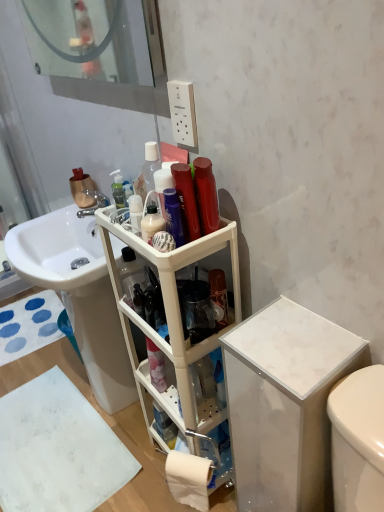
How much space does white plastic shelf at center, which ranks as the 1th cabinetry in left-to-right order, occupy horizontally?

It is 10.60 inches.

In order to face white glossy sink at center, should I rotate leftwards or rightwards?

Turn left by 13.289 degrees to look at white glossy sink at center.

Image resolution: width=384 pixels, height=512 pixels. I want to click on white matte bath mat at lower left, positioned as the 2th bath mat in back-to-front order, so (x=58, y=449).

Identify the location of shiny red bottle at upper center, the 2th cleaning product from the left. This screenshot has height=512, width=384. click(x=206, y=195).

Is white plastic shelf at center, the second cabinetry in the right-to-left sequence, next to metallic silver faucet at sink left?

white plastic shelf at center, the second cabinetry in the right-to-left sequence, is not next to metallic silver faucet at sink left, and they're not touching.

Is white plastic shelf at center, which ranks as the 1th cabinetry in left-to-right order, bigger or smaller than metallic silver faucet at sink left?

white plastic shelf at center, which ranks as the 1th cabinetry in left-to-right order, is bigger than metallic silver faucet at sink left.

From the image's perspective, is white plastic shelf at center, the second cabinetry in the right-to-left sequence, below metallic silver faucet at sink left?

Yes, from the image's perspective, white plastic shelf at center, the second cabinetry in the right-to-left sequence, is below metallic silver faucet at sink left.

Considering their positions, is white plastic shelf at center, which ranks as the 1th cabinetry in left-to-right order, located in front of or behind metallic silver faucet at sink left?

In the image, white plastic shelf at center, which ranks as the 1th cabinetry in left-to-right order, appears in front of metallic silver faucet at sink left.

Is point (201, 186) closer or farther from the camera than point (303, 335)?

Point (201, 186) appears to be farther away from the viewer than point (303, 335).

Does shiny red bottle at upper center, which is counted as the first cleaning product, starting from the right, lie in front of white marble cabinet at right, arranged as the second cabinetry when viewed from the left?

No, it is not.

Is shiny red bottle at upper center, the 2th cleaning product from the left, far away from white marble cabinet at right, arranged as the second cabinetry when viewed from the left?

No, shiny red bottle at upper center, the 2th cleaning product from the left, is not far away from white marble cabinet at right, arranged as the second cabinetry when viewed from the left.

Choose the correct answer: Is shiny red bottle at upper center, which is counted as the first cleaning product, starting from the right, inside shiny red hair spray at upper center, which is counted as the 1th toiletry, starting from the top, or outside it?

shiny red bottle at upper center, which is counted as the first cleaning product, starting from the right, exists outside the volume of shiny red hair spray at upper center, which is counted as the 1th toiletry, starting from the top.

From a real-world perspective, is shiny red bottle at upper center, which is counted as the first cleaning product, starting from the right, positioned over shiny red hair spray at upper center, which ranks as the 4th toiletry in back-to-front order, based on gravity?

No, from a real-world perspective, shiny red bottle at upper center, which is counted as the first cleaning product, starting from the right, is not on top of shiny red hair spray at upper center, which ranks as the 4th toiletry in back-to-front order.

In terms of height, does shiny red bottle at upper center, the 2th cleaning product from the left, look taller or shorter compared to shiny red hair spray at upper center, the fourth toiletry when ordered from bottom to top?

In the image, shiny red bottle at upper center, the 2th cleaning product from the left, appears to be shorter than shiny red hair spray at upper center, the fourth toiletry when ordered from bottom to top.

Is point (185, 189) positioned before point (133, 357)?

Yes, point (185, 189) is in front of point (133, 357).

Is shiny red hair spray at upper center, which is the 1th toiletry from front to back, facing away from white plastic shelf at center, which ranks as the 1th cabinetry in left-to-right order?

No, white plastic shelf at center, which ranks as the 1th cabinetry in left-to-right order, is not at the back of shiny red hair spray at upper center, which is the 1th toiletry from front to back.

Can you confirm if shiny red hair spray at upper center, the fourth toiletry when ordered from bottom to top, is smaller than white plastic shelf at center, which ranks as the 1th cabinetry in left-to-right order?

Correct, shiny red hair spray at upper center, the fourth toiletry when ordered from bottom to top, occupies less space than white plastic shelf at center, which ranks as the 1th cabinetry in left-to-right order.

Considering the sizes of white plastic shelf at center, the second cabinetry in the right-to-left sequence, and pink matte spray can at center, arranged as the 1th toiletry when ordered from the bottom, in the image, is white plastic shelf at center, the second cabinetry in the right-to-left sequence, wider or thinner than pink matte spray can at center, arranged as the 1th toiletry when ordered from the bottom,?

Considering their sizes, white plastic shelf at center, the second cabinetry in the right-to-left sequence, looks broader than pink matte spray can at center, arranged as the 1th toiletry when ordered from the bottom.

Is the position of white plastic shelf at center, which ranks as the 1th cabinetry in left-to-right order, less distant than that of pink matte spray can at center, arranged as the 1th toiletry when ordered from the bottom?

Yes, the depth of white plastic shelf at center, which ranks as the 1th cabinetry in left-to-right order, is less than that of pink matte spray can at center, arranged as the 1th toiletry when ordered from the bottom.

Is white plastic shelf at center, which ranks as the 1th cabinetry in left-to-right order, not within pink matte spray can at center, the 4th toiletry from the top?

Indeed, white plastic shelf at center, which ranks as the 1th cabinetry in left-to-right order, is completely outside pink matte spray can at center, the 4th toiletry from the top.

From a real-world perspective, is white plastic shelf at center, the second cabinetry in the right-to-left sequence, on top of pink matte spray can at center, arranged as the 1th toiletry when ordered from the bottom?

Yes, from a real-world perspective, white plastic shelf at center, the second cabinetry in the right-to-left sequence, is over pink matte spray can at center, arranged as the 1th toiletry when ordered from the bottom

From the picture: Could you tell me if translucent plastic pump bottle at upper center, which is the second toiletry in top-to-bottom order, is turned towards white matte bath mat at lower left, positioned as the 2th bath mat in back-to-front order?

No, translucent plastic pump bottle at upper center, which is the second toiletry in top-to-bottom order, is not facing towards white matte bath mat at lower left, positioned as the 2th bath mat in back-to-front order.

Looking at this image, is translucent plastic pump bottle at upper center, the 3th toiletry viewed from the front, positioned behind white matte bath mat at lower left, positioned as the 2th bath mat in back-to-front order?

No, translucent plastic pump bottle at upper center, the 3th toiletry viewed from the front, is closer to the camera.

In the scene shown: Can you confirm if translucent plastic pump bottle at upper center, the 3th toiletry viewed from the front, is bigger than white matte bath mat at lower left, arranged as the 1th bath mat when ordered from the bottom?

Incorrect, translucent plastic pump bottle at upper center, the 3th toiletry viewed from the front, is not larger than white matte bath mat at lower left, arranged as the 1th bath mat when ordered from the bottom.

Is translucent plastic pump bottle at upper center, which is the second toiletry in top-to-bottom order, taller or shorter than white matte bath mat at lower left, positioned as the 2th bath mat in back-to-front order?

translucent plastic pump bottle at upper center, which is the second toiletry in top-to-bottom order, is taller than white matte bath mat at lower left, positioned as the 2th bath mat in back-to-front order.

From the picture: Is white plastic shelf at center, which ranks as the 1th cabinetry in left-to-right order, outside of clear glass mirror at upper left?

Indeed, white plastic shelf at center, which ranks as the 1th cabinetry in left-to-right order, is completely outside clear glass mirror at upper left.

How far apart are white plastic shelf at center, which ranks as the 1th cabinetry in left-to-right order, and clear glass mirror at upper left?

4.08 feet.

Between point (118, 279) and point (48, 10), which one is positioned in front?

Positioned in front is point (118, 279).

Considering the relative sizes of white plastic shelf at center, the second cabinetry in the right-to-left sequence, and clear glass mirror at upper left in the image provided, is white plastic shelf at center, the second cabinetry in the right-to-left sequence, smaller than clear glass mirror at upper left?

No.

Locate an element on the screen. The image size is (384, 512). the 1st cabinetry to the right when counting from the metallic silver faucet at sink left is located at coordinates (171, 325).

The image size is (384, 512). I want to click on cabinetry that is the 2nd object located below the shiny red bottle at upper center, the 2th cleaning product from the left (from the image's perspective), so click(x=285, y=404).

Estimate the real-world distances between objects in this image. Which object is further from shiny red bottle at upper center, which is counted as the first cleaning product, starting from the right, translucent plastic bottle at center, the second cleaning product from the right, or clear glass mirror at upper left?

Among the two, clear glass mirror at upper left is located further to shiny red bottle at upper center, which is counted as the first cleaning product, starting from the right.

Based on their spatial positions, is shiny red bottle at upper center, which is counted as the first cleaning product, starting from the right, or shiny purple bottle at upper center, the second toiletry from the front, further from pink matte spray can at center, the 4th toiletry from the top?

shiny red bottle at upper center, which is counted as the first cleaning product, starting from the right, is positioned further to the anchor pink matte spray can at center, the 4th toiletry from the top.

Based on their spatial positions, is clear glass mirror at upper left or shiny red bottle at upper center, which is counted as the first cleaning product, starting from the right, further from shiny purple bottle at upper center, the second toiletry from the front?

The object further to shiny purple bottle at upper center, the second toiletry from the front, is clear glass mirror at upper left.

Which object lies nearer to the anchor point shiny purple bottle at upper center, the third toiletry in the back-to-front sequence, white matte toilet paper at lower center or shiny red bottle at upper center, the 2th cleaning product from the left?

The object closer to shiny purple bottle at upper center, the third toiletry in the back-to-front sequence, is shiny red bottle at upper center, the 2th cleaning product from the left.

Looking at the image, which one is located closer to white plastic shelf at center, the second cabinetry in the right-to-left sequence, white marble cabinet at right, arranged as the second cabinetry when viewed from the left, or translucent plastic bottle at center, arranged as the first cleaning product when viewed from the left?

The object closer to white plastic shelf at center, the second cabinetry in the right-to-left sequence, is white marble cabinet at right, arranged as the second cabinetry when viewed from the left.

Based on their spatial positions, is shiny red hair spray at upper center, which is counted as the 1th toiletry, starting from the top, or white matte bath mat at lower left, arranged as the 1th bath mat when ordered from the bottom, closer to white plastic shelf at center, which ranks as the 1th cabinetry in left-to-right order?

shiny red hair spray at upper center, which is counted as the 1th toiletry, starting from the top.

Looking at the image, which one is located further to white marble cabinet at right, arranged as the second cabinetry when viewed from the left, white matte toilet paper at lower center or white fabric bath mat at lower left, the 1th bath mat viewed from the top?

The object further to white marble cabinet at right, arranged as the second cabinetry when viewed from the left, is white fabric bath mat at lower left, the 1th bath mat viewed from the top.

Based on the photo, looking at the image, which one is located further to translucent plastic pump bottle at upper center, which ranks as the 3th toiletry in bottom-to-top order, white matte bath mat at lower left, positioned as the 2th bath mat in back-to-front order, or white fabric bath mat at lower left, which is the 2th bath mat in front-to-back order?

Based on the image, white fabric bath mat at lower left, which is the 2th bath mat in front-to-back order, appears to be further to translucent plastic pump bottle at upper center, which ranks as the 3th toiletry in bottom-to-top order.

Where is `cabinetry that lies between shiny red bottle at upper center, the 2th cleaning product from the left, and white marble cabinet at right, which ranks as the first cabinetry in right-to-left order, from top to bottom`? The image size is (384, 512). cabinetry that lies between shiny red bottle at upper center, the 2th cleaning product from the left, and white marble cabinet at right, which ranks as the first cabinetry in right-to-left order, from top to bottom is located at coordinates (171, 325).

Where is `cabinetry between translucent plastic bottle at center, the second cleaning product from the right, and pink matte spray can at center, the 4th toiletry from the top, vertically`? The height and width of the screenshot is (512, 384). cabinetry between translucent plastic bottle at center, the second cleaning product from the right, and pink matte spray can at center, the 4th toiletry from the top, vertically is located at coordinates (171, 325).

This screenshot has width=384, height=512. Identify the location of sink between shiny red bottle at upper center, which is counted as the first cleaning product, starting from the right, and white matte toilet paper at lower center in the up-down direction. (79, 295).

Where is `bath mat between shiny purple bottle at upper center, the second toiletry from the front, and white fabric bath mat at lower left, which is the first bath mat in back-to-front order, along the z-axis`? bath mat between shiny purple bottle at upper center, the second toiletry from the front, and white fabric bath mat at lower left, which is the first bath mat in back-to-front order, along the z-axis is located at coordinates (58, 449).